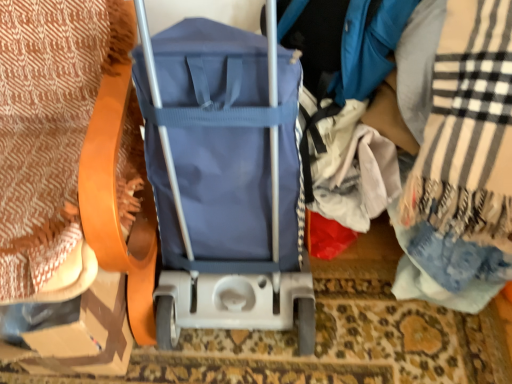
Question: Considering the positions of cardboard at left and patterned fabric blanket at left, arranged as the first blanket when viewed from the left, in the image, is cardboard at left bigger or smaller than patterned fabric blanket at left, arranged as the first blanket when viewed from the left,?

Choices:
 (A) small
 (B) big

Answer: (A)

Question: From a real-world perspective, relative to patterned fabric blanket at left, the second blanket when ordered from right to left, is cardboard at left vertically above or below?

Choices:
 (A) below
 (B) above

Answer: (A)

Question: Which object is the farthest from the patterned fabric blanket at left, the second blanket when ordered from right to left?

Choices:
 (A) cardboard at left
 (B) plaid woolen blanket at right, the second blanket positioned from the left

Answer: (B)

Question: Based on their relative distances, which object is farther from the patterned fabric blanket at left, the second blanket when ordered from right to left?

Choices:
 (A) plaid woolen blanket at right, the second blanket positioned from the left
 (B) cardboard at left

Answer: (A)